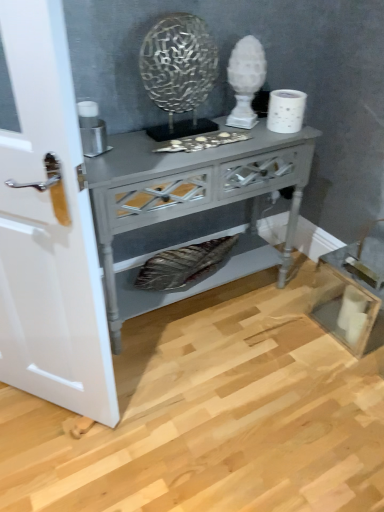
Question: From a real-world perspective, is white textured toilet paper at upper right on top of matte gray wooden nightstand at center?

Choices:
 (A) yes
 (B) no

Answer: (A)

Question: Would you say matte gray wooden nightstand at center is part of white textured toilet paper at upper right's contents?

Choices:
 (A) yes
 (B) no

Answer: (B)

Question: Does white textured toilet paper at upper right have a larger size compared to matte gray wooden nightstand at center?

Choices:
 (A) no
 (B) yes

Answer: (A)

Question: Considering the relative sizes of white textured toilet paper at upper right and matte gray wooden nightstand at center in the image provided, is white textured toilet paper at upper right shorter than matte gray wooden nightstand at center?

Choices:
 (A) no
 (B) yes

Answer: (B)

Question: Are white textured toilet paper at upper right and matte gray wooden nightstand at center making contact?

Choices:
 (A) yes
 (B) no

Answer: (B)

Question: In the image, is white glossy door at left positioned in front of or behind metallic silver candle holder at left?

Choices:
 (A) front
 (B) behind

Answer: (A)

Question: From a real-world perspective, relative to metallic silver candle holder at left, is white glossy door at left vertically above or below?

Choices:
 (A) above
 (B) below

Answer: (B)

Question: Looking at the image, does white glossy door at left seem bigger or smaller compared to metallic silver candle holder at left?

Choices:
 (A) big
 (B) small

Answer: (A)

Question: Considering the positions of point click(x=33, y=60) and point click(x=94, y=135), is point click(x=33, y=60) closer or farther from the camera than point click(x=94, y=135)?

Choices:
 (A) farther
 (B) closer

Answer: (B)

Question: Looking at the image, does white glossy door at left seem bigger or smaller compared to matte gray wooden nightstand at center?

Choices:
 (A) big
 (B) small

Answer: (B)

Question: From a real-world perspective, is white glossy door at left above or below matte gray wooden nightstand at center?

Choices:
 (A) below
 (B) above

Answer: (B)

Question: From the image's perspective, relative to matte gray wooden nightstand at center, is white glossy door at left above or below?

Choices:
 (A) above
 (B) below

Answer: (B)

Question: Is white glossy door at left in front of or behind matte gray wooden nightstand at center in the image?

Choices:
 (A) behind
 (B) front

Answer: (B)

Question: Considering the positions of metallic silver candle holder at left and white glossy door at left in the image, is metallic silver candle holder at left taller or shorter than white glossy door at left?

Choices:
 (A) tall
 (B) short

Answer: (B)

Question: Would you say metallic silver candle holder at left is to the left or to the right of white glossy door at left in the picture?

Choices:
 (A) right
 (B) left

Answer: (A)